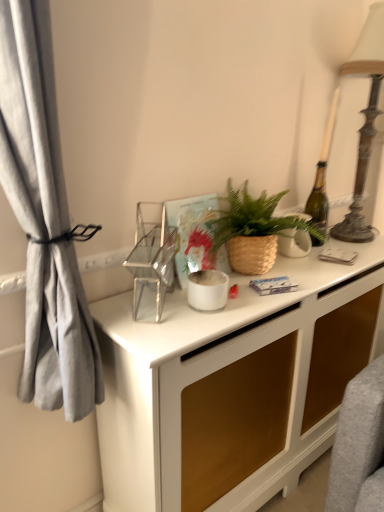
Question: Is antique bronze table lamp at right taller than white ceramic vase at center, which is counted as the third appliance, starting from the front?

Choices:
 (A) yes
 (B) no

Answer: (A)

Question: Does antique bronze table lamp at right appear on the left side of white ceramic vase at center, marked as the 1th appliance in a right-to-left arrangement?

Choices:
 (A) yes
 (B) no

Answer: (B)

Question: Is antique bronze table lamp at right outside of white ceramic vase at center, the 3th appliance when ordered from left to right?

Choices:
 (A) yes
 (B) no

Answer: (A)

Question: Considering the relative sizes of antique bronze table lamp at right and white ceramic vase at center, the 3th appliance when ordered from left to right, in the image provided, is antique bronze table lamp at right smaller than white ceramic vase at center, the 3th appliance when ordered from left to right,?

Choices:
 (A) no
 (B) yes

Answer: (A)

Question: Does antique bronze table lamp at right have a larger size compared to white ceramic vase at center, the 3th appliance when ordered from left to right?

Choices:
 (A) no
 (B) yes

Answer: (B)

Question: From a real-world perspective, is antique bronze table lamp at right on white ceramic vase at center, the 3th appliance when ordered from left to right?

Choices:
 (A) yes
 (B) no

Answer: (A)

Question: Considering the relative sizes of clear glass shelf at center, positioned as the 3th appliance in right-to-left order, and white matte pot at center, acting as the 2th appliance starting from the left, in the image provided, is clear glass shelf at center, positioned as the 3th appliance in right-to-left order, smaller than white matte pot at center, acting as the 2th appliance starting from the left,?

Choices:
 (A) no
 (B) yes

Answer: (A)

Question: Is clear glass shelf at center, which is the third appliance from back to front, looking in the opposite direction of white matte pot at center, marked as the second appliance in a front-to-back arrangement?

Choices:
 (A) no
 (B) yes

Answer: (A)

Question: Is clear glass shelf at center, which is the third appliance from back to front, completely or partially outside of white matte pot at center, positioned as the second appliance in back-to-front order?

Choices:
 (A) yes
 (B) no

Answer: (A)

Question: From the image's perspective, is clear glass shelf at center, positioned as the 3th appliance in right-to-left order, located beneath white matte pot at center, positioned as the second appliance in back-to-front order?

Choices:
 (A) yes
 (B) no

Answer: (B)

Question: Can you confirm if clear glass shelf at center, the first appliance viewed from the front, is positioned to the left of white matte pot at center, marked as the second appliance in a front-to-back arrangement?

Choices:
 (A) yes
 (B) no

Answer: (A)

Question: Is clear glass shelf at center, positioned as the 3th appliance in right-to-left order, directly adjacent to white matte pot at center, which is the 2th appliance in right-to-left order?

Choices:
 (A) yes
 (B) no

Answer: (B)

Question: Is white matte pot at center, acting as the 2th appliance starting from the left, oriented towards white ceramic vase at center, positioned as the first appliance in back-to-front order?

Choices:
 (A) no
 (B) yes

Answer: (A)